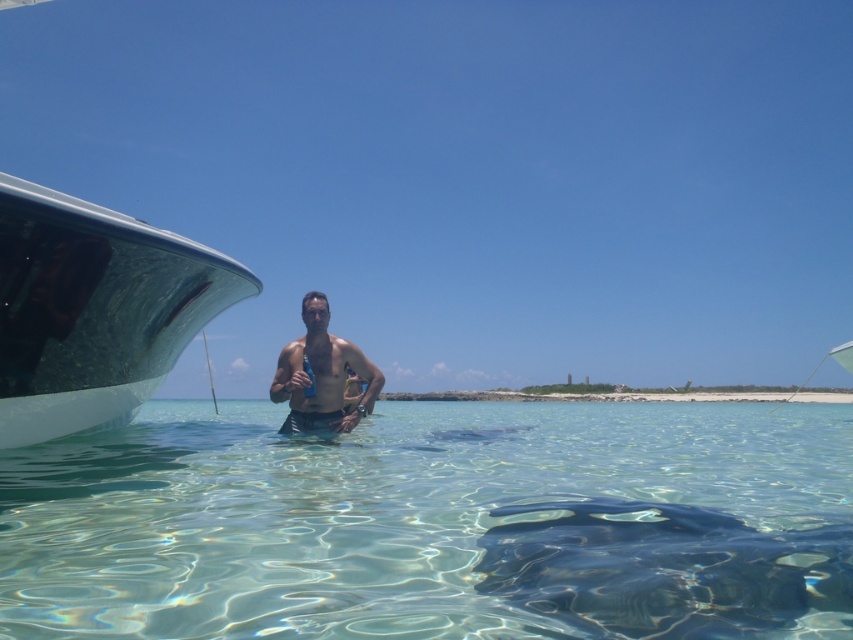
Does clear water at center appear under shiny white boat at left?

Indeed, clear water at center is positioned under shiny white boat at left.

Is clear water at center shorter than shiny white boat at left?

Correct, clear water at center is not as tall as shiny white boat at left.

Which is behind, point (476, 433) or point (74, 333)?

The point (476, 433) is behind.

What are the coordinates of `clear water at center` in the screenshot? It's located at (436, 524).

Which is more to the left, shiny white boat at left or smooth skin man at center?

Positioned to the left is shiny white boat at left.

Does shiny white boat at left come behind smooth skin man at center?

No, shiny white boat at left is closer to the viewer.

Locate an element on the screen. shiny white boat at left is located at coordinates (94, 308).

Is clear water at center to the right of smooth skin man at center from the viewer's perspective?

Indeed, clear water at center is positioned on the right side of smooth skin man at center.

The height and width of the screenshot is (640, 853). What do you see at coordinates (436, 524) in the screenshot? I see `clear water at center` at bounding box center [436, 524].

Locate an element on the screen. clear water at center is located at coordinates (436, 524).